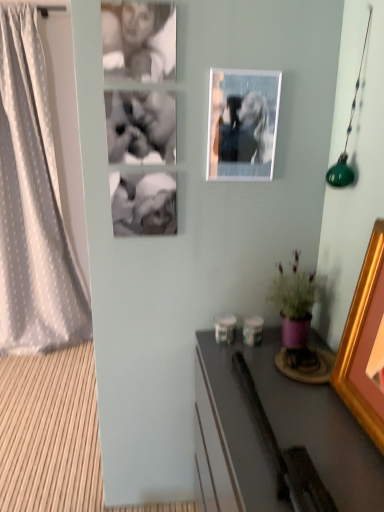
The image size is (384, 512). Describe the element at coordinates (33, 205) in the screenshot. I see `white dotted fabric curtain at left` at that location.

Based on the photo, measure the distance between purple matte pot at lower right and camera.

A distance of 1.30 meters exists between purple matte pot at lower right and camera.

Locate an element on the screen. metallic silver photo frame at upper center, the first picture frame in the back-to-front sequence is located at coordinates (242, 123).

Find the location of a particular element. This screenshot has width=384, height=512. gold wooden picture frame at right, the second picture frame in the top-to-bottom sequence is located at coordinates (363, 342).

In terms of width, does metallic silver photo frame at upper center, the first picture frame in the back-to-front sequence, look wider or thinner when compared to white dotted fabric curtain at left?

In the image, metallic silver photo frame at upper center, the first picture frame in the back-to-front sequence, appears to be more narrow than white dotted fabric curtain at left.

Is metallic silver photo frame at upper center, arranged as the second picture frame when ordered from the bottom, not inside white dotted fabric curtain at left?

metallic silver photo frame at upper center, arranged as the second picture frame when ordered from the bottom, lies outside white dotted fabric curtain at left's area.

Does metallic silver photo frame at upper center, the first picture frame in the back-to-front sequence, have a greater height compared to white dotted fabric curtain at left?

Incorrect, the height of metallic silver photo frame at upper center, the first picture frame in the back-to-front sequence, is not larger of that of white dotted fabric curtain at left.

How many degrees apart are the facing directions of metallic silver photo frame at upper center, which ranks as the 2th picture frame in right-to-left order, and white dotted fabric curtain at left?

1.41 degrees.

From a real-world perspective, between gold wooden picture frame at right, marked as the 1th picture frame in a right-to-left arrangement, and purple matte pot at lower right, who is vertically higher?

gold wooden picture frame at right, marked as the 1th picture frame in a right-to-left arrangement, from a real-world perspective.

From the image's perspective, does gold wooden picture frame at right, marked as the 2th picture frame in a back-to-front arrangement, appear higher than purple matte pot at lower right?

No.

How many degrees apart are the facing directions of gold wooden picture frame at right, marked as the 2th picture frame in a back-to-front arrangement, and purple matte pot at lower right?

The angle between the facing direction of gold wooden picture frame at right, marked as the 2th picture frame in a back-to-front arrangement, and the facing direction of purple matte pot at lower right is 0.411 degrees.

Can you confirm if gold wooden picture frame at right, marked as the 2th picture frame in a back-to-front arrangement, is taller than purple matte pot at lower right?

Correct, gold wooden picture frame at right, marked as the 2th picture frame in a back-to-front arrangement, is much taller as purple matte pot at lower right.

Is gold wooden picture frame at right, acting as the first picture frame starting from the bottom, shorter than metallic silver photo frame at upper center, which ranks as the 2th picture frame in right-to-left order?

No.

Is point (367, 357) positioned behind point (259, 121)?

No.

Is gold wooden picture frame at right, marked as the second picture frame in a left-to-right arrangement, turned away from metallic silver photo frame at upper center, which ranks as the 2th picture frame in right-to-left order?

That's not correct — gold wooden picture frame at right, marked as the second picture frame in a left-to-right arrangement, is not looking away from metallic silver photo frame at upper center, which ranks as the 2th picture frame in right-to-left order.

From the picture: What's the angular difference between gold wooden picture frame at right, marked as the 1th picture frame in a right-to-left arrangement, and metallic silver photo frame at upper center, which appears as the second picture frame when viewed from the front,'s facing directions?

They differ by 88.4 degrees in their facing directions.

Looking at this image, from the image's perspective, between metallic silver photo frame at upper center, the first picture frame in the back-to-front sequence, and smooth gray desk at lower right, who is located below?

smooth gray desk at lower right is shown below in the image.

From a real-world perspective, is metallic silver photo frame at upper center, the first picture frame viewed from the left, physically above smooth gray desk at lower right?

Correct, in the physical world, metallic silver photo frame at upper center, the first picture frame viewed from the left, is higher than smooth gray desk at lower right.

Is metallic silver photo frame at upper center, the first picture frame in the back-to-front sequence, surrounding smooth gray desk at lower right?

Definitely not — smooth gray desk at lower right is not inside metallic silver photo frame at upper center, the first picture frame in the back-to-front sequence.

Are metallic silver photo frame at upper center, arranged as the second picture frame when ordered from the bottom, and gold wooden picture frame at right, marked as the 1th picture frame in a right-to-left arrangement, making contact?

No, metallic silver photo frame at upper center, arranged as the second picture frame when ordered from the bottom, is not beside gold wooden picture frame at right, marked as the 1th picture frame in a right-to-left arrangement.

Between metallic silver photo frame at upper center, arranged as the second picture frame when ordered from the bottom, and gold wooden picture frame at right, marked as the second picture frame in a left-to-right arrangement, which one has larger size?

gold wooden picture frame at right, marked as the second picture frame in a left-to-right arrangement, is bigger.

Can gold wooden picture frame at right, acting as the first picture frame starting from the bottom, be found inside metallic silver photo frame at upper center, arranged as the second picture frame when ordered from the bottom?

No, metallic silver photo frame at upper center, arranged as the second picture frame when ordered from the bottom, does not contain gold wooden picture frame at right, acting as the first picture frame starting from the bottom.

Based on the photo, does metallic silver photo frame at upper center, which ranks as the 2th picture frame in right-to-left order, have a greater width compared to gold wooden picture frame at right, marked as the 2th picture frame in a back-to-front arrangement?

No.

The height and width of the screenshot is (512, 384). What are the coordinates of `curtain on the left side of gold wooden picture frame at right, the second picture frame in the top-to-bottom sequence` in the screenshot? It's located at (33, 205).

Considering the positions of objects gold wooden picture frame at right, marked as the 2th picture frame in a back-to-front arrangement, and white dotted fabric curtain at left in the image provided, who is more to the right, gold wooden picture frame at right, marked as the 2th picture frame in a back-to-front arrangement, or white dotted fabric curtain at left?

Positioned to the right is gold wooden picture frame at right, marked as the 2th picture frame in a back-to-front arrangement.

Is gold wooden picture frame at right, which is counted as the first picture frame, starting from the front, inside or outside of white dotted fabric curtain at left?

gold wooden picture frame at right, which is counted as the first picture frame, starting from the front, is located beyond the bounds of white dotted fabric curtain at left.

Is smooth gray desk at lower right positioned in front of purple matte pot at lower right?

Yes, smooth gray desk at lower right is closer to the viewer.

Locate an element on the screen. This screenshot has height=512, width=384. houseplant on the right of smooth gray desk at lower right is located at coordinates (295, 302).

From a real-world perspective, is smooth gray desk at lower right physically below purple matte pot at lower right?

Yes, from a real-world perspective, smooth gray desk at lower right is below purple matte pot at lower right.

Does smooth gray desk at lower right appear on the right side of purple matte pot at lower right?

No.

The width and height of the screenshot is (384, 512). In order to click on picture frame positioned vertically above the white dotted fabric curtain at left (from a real-world perspective) in this screenshot , I will do `click(242, 123)`.

The height and width of the screenshot is (512, 384). Identify the location of picture frame in front of the purple matte pot at lower right. click(363, 342).

Considering their positions, is metallic silver photo frame at upper center, arranged as the second picture frame when ordered from the bottom, positioned closer to gold wooden picture frame at right, marked as the second picture frame in a left-to-right arrangement, than white dotted fabric curtain at left?

metallic silver photo frame at upper center, arranged as the second picture frame when ordered from the bottom.

Which object lies nearer to the anchor point metallic silver photo frame at upper center, which appears as the second picture frame when viewed from the front, smooth gray desk at lower right or purple matte pot at lower right?

purple matte pot at lower right.

Looking at the image, which one is located further to smooth gray desk at lower right, gold wooden picture frame at right, the second picture frame in the top-to-bottom sequence, or white dotted fabric curtain at left?

white dotted fabric curtain at left is further to smooth gray desk at lower right.

Which object lies nearer to the anchor point smooth gray desk at lower right, purple matte pot at lower right or metallic silver photo frame at upper center, the first picture frame viewed from the left?

purple matte pot at lower right is closer to smooth gray desk at lower right.

From the image, which object appears to be nearer to white dotted fabric curtain at left, gold wooden picture frame at right, marked as the 1th picture frame in a right-to-left arrangement, or metallic silver photo frame at upper center, arranged as the second picture frame when ordered from the bottom?

Based on the image, metallic silver photo frame at upper center, arranged as the second picture frame when ordered from the bottom, appears to be nearer to white dotted fabric curtain at left.

Estimate the real-world distances between objects in this image. Which object is closer to metallic silver photo frame at upper center, which appears as the second picture frame when viewed from the front, purple matte pot at lower right or white dotted fabric curtain at left?

purple matte pot at lower right lies closer to metallic silver photo frame at upper center, which appears as the second picture frame when viewed from the front, than the other object.

Considering their positions, is smooth gray desk at lower right positioned further to white dotted fabric curtain at left than gold wooden picture frame at right, the second picture frame in the top-to-bottom sequence?

The object further to white dotted fabric curtain at left is gold wooden picture frame at right, the second picture frame in the top-to-bottom sequence.

Based on their spatial positions, is smooth gray desk at lower right or purple matte pot at lower right further from gold wooden picture frame at right, marked as the 1th picture frame in a right-to-left arrangement?

purple matte pot at lower right lies further to gold wooden picture frame at right, marked as the 1th picture frame in a right-to-left arrangement, than the other object.

Where is `houseplant between metallic silver photo frame at upper center, arranged as the second picture frame when ordered from the bottom, and gold wooden picture frame at right, marked as the 2th picture frame in a back-to-front arrangement, in the vertical direction`? This screenshot has width=384, height=512. houseplant between metallic silver photo frame at upper center, arranged as the second picture frame when ordered from the bottom, and gold wooden picture frame at right, marked as the 2th picture frame in a back-to-front arrangement, in the vertical direction is located at coordinates (295, 302).

You are a GUI agent. You are given a task and a screenshot of the screen. Output one action in this format:
    pyautogui.click(x=<x>, y=<y>)
    Task: Click on the houseplant located between white dotted fabric curtain at left and gold wooden picture frame at right, which is counted as the first picture frame, starting from the front, in the left-right direction
    
    Given the screenshot: What is the action you would take?
    pyautogui.click(x=295, y=302)

Identify the location of picture frame between white dotted fabric curtain at left and smooth gray desk at lower right. This screenshot has height=512, width=384. (242, 123).

Identify the location of picture frame that lies between purple matte pot at lower right and smooth gray desk at lower right from top to bottom. This screenshot has height=512, width=384. (363, 342).